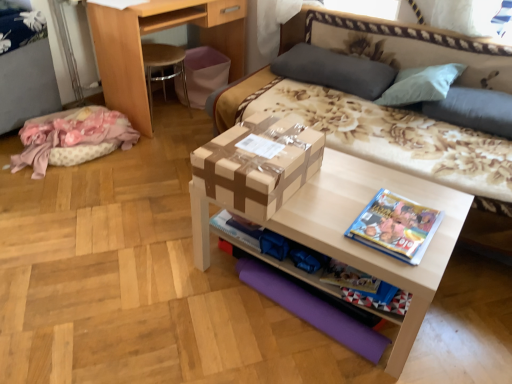
You are a GUI agent. You are given a task and a screenshot of the screen. Output one action in this format:
    pyautogui.click(x=<x>, y=<y>)
    Task: Click on the blank area to the left of blue glossy book at right
    
    Given the screenshot: What is the action you would take?
    pyautogui.click(x=327, y=215)